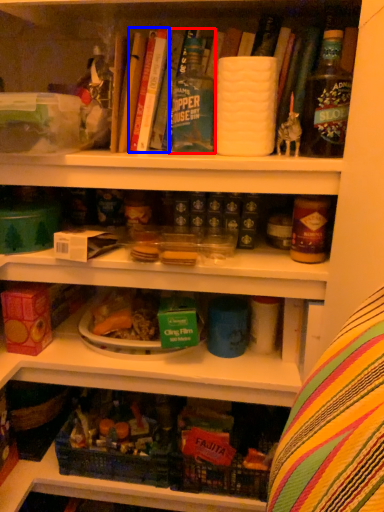
Question: Which point is further to the camera, bottle (highlighted by a red box) or book (highlighted by a blue box)?

Choices:
 (A) bottle
 (B) book

Answer: (B)